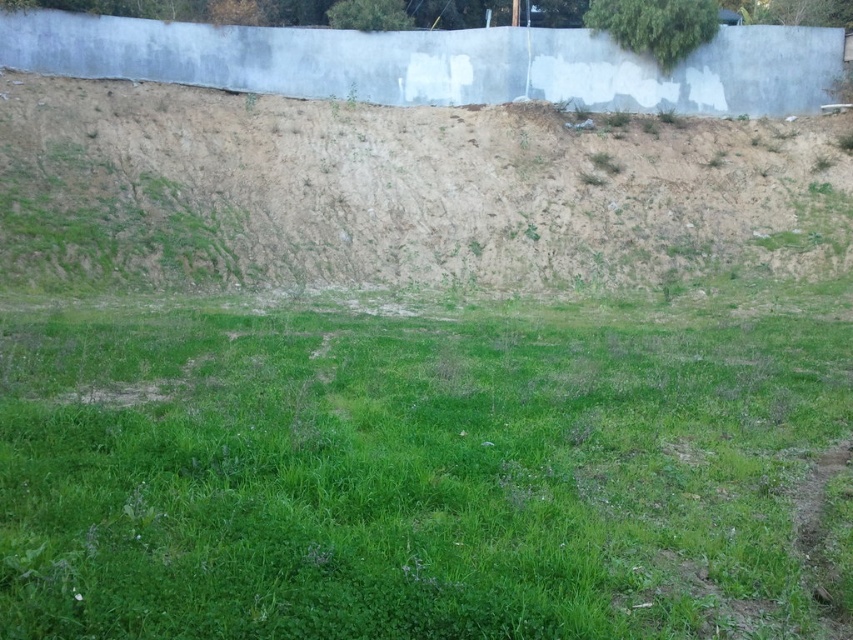
You are standing on the green grassy field at center and want to walk to the dull brown dirt at upper center. Which direction should you move to reach it?

You should move to the right since the green grassy field at center is to the left of dull brown dirt at upper center, so moving right would take you towards it.

You are standing at the origin point in the image. Which direction should you move to reach the green grassy field at center?

The green grassy field at center is located at point (415, 470), so you should move towards the center of the image to reach it.